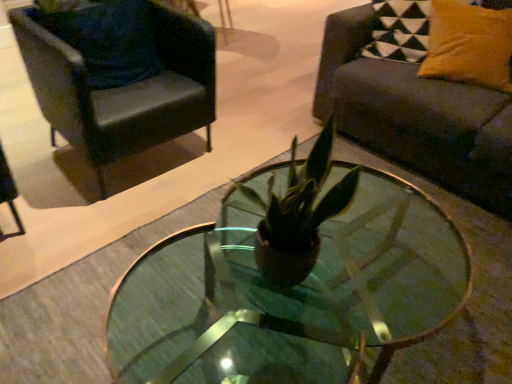
Describe the element at coordinates (469, 45) in the screenshot. The height and width of the screenshot is (384, 512). I see `velvet yellow pillow at upper right, the 1th pillow from the right` at that location.

The height and width of the screenshot is (384, 512). Describe the element at coordinates (289, 295) in the screenshot. I see `transparent glass coffee table at center` at that location.

How much space does velvet dark blue pillow at upper left, positioned as the 1th pillow in left-to-right order, occupy vertically?

The height of velvet dark blue pillow at upper left, positioned as the 1th pillow in left-to-right order, is 21.68 inches.

The width and height of the screenshot is (512, 384). Identify the location of velvet dark blue pillow at upper left, positioned as the 1th pillow in left-to-right order. (106, 38).

The width and height of the screenshot is (512, 384). Find the location of `velvet yellow pillow at upper right, the 1th pillow from the right`. velvet yellow pillow at upper right, the 1th pillow from the right is located at coordinates (469, 45).

How different are the orientations of velvet yellow pillow at upper right, which is the 2th pillow from left to right, and dark gray fabric couch at right in degrees?

15.5 degrees separate the facing orientations of velvet yellow pillow at upper right, which is the 2th pillow from left to right, and dark gray fabric couch at right.

Is dark gray fabric couch at right located within velvet yellow pillow at upper right, the 1th pillow from the right?

Definitely not — dark gray fabric couch at right is not inside velvet yellow pillow at upper right, the 1th pillow from the right.

Considering the sizes of objects velvet yellow pillow at upper right, which is the 2th pillow from left to right, and dark gray fabric couch at right in the image provided, who is bigger, velvet yellow pillow at upper right, which is the 2th pillow from left to right, or dark gray fabric couch at right?

Bigger between the two is dark gray fabric couch at right.

Is velvet yellow pillow at upper right, which is the 2th pillow from left to right, touching dark gray fabric couch at right?

No, velvet yellow pillow at upper right, which is the 2th pillow from left to right, is not beside dark gray fabric couch at right.

Would you consider black leather chair at upper left to be distant from dark gray fabric couch at right?

That's right, there is a large distance between black leather chair at upper left and dark gray fabric couch at right.

How distant is black leather chair at upper left from dark gray fabric couch at right?

black leather chair at upper left and dark gray fabric couch at right are 3.59 feet apart.

Is black leather chair at upper left oriented away from dark gray fabric couch at right?

black leather chair at upper left is not turned away from dark gray fabric couch at right.

Based on the photo, from a real-world perspective, is black leather chair at upper left positioned above or below dark gray fabric couch at right?

From a real-world perspective, black leather chair at upper left is physically below dark gray fabric couch at right.

From a real-world perspective, is velvet yellow pillow at upper right, which is the 2th pillow from left to right, on velvet dark blue pillow at upper left, marked as the 2th pillow in a right-to-left arrangement?

Yes.

Could velvet dark blue pillow at upper left, positioned as the 1th pillow in left-to-right order, be considered to be inside velvet yellow pillow at upper right, which is the 2th pillow from left to right?

No.

Considering the positions of objects velvet yellow pillow at upper right, which is the 2th pillow from left to right, and velvet dark blue pillow at upper left, marked as the 2th pillow in a right-to-left arrangement, in the image provided, who is more to the left, velvet yellow pillow at upper right, which is the 2th pillow from left to right, or velvet dark blue pillow at upper left, marked as the 2th pillow in a right-to-left arrangement,?

Positioned to the left is velvet dark blue pillow at upper left, marked as the 2th pillow in a right-to-left arrangement.

Is velvet yellow pillow at upper right, the 1th pillow from the right, positioned far away from velvet dark blue pillow at upper left, positioned as the 1th pillow in left-to-right order?

Indeed, velvet yellow pillow at upper right, the 1th pillow from the right, is not near velvet dark blue pillow at upper left, positioned as the 1th pillow in left-to-right order.

Which of these two, transparent glass coffee table at center or dark gray fabric couch at right, is wider?

dark gray fabric couch at right.

From the image's perspective, who appears lower, transparent glass coffee table at center or dark gray fabric couch at right?

transparent glass coffee table at center, from the image's perspective.

Is transparent glass coffee table at center closer to the viewer compared to dark gray fabric couch at right?

Yes, it is in front of dark gray fabric couch at right.

How much distance is there between transparent glass coffee table at center and dark gray fabric couch at right?

A distance of 28.64 inches exists between transparent glass coffee table at center and dark gray fabric couch at right.

From a real-world perspective, between velvet dark blue pillow at upper left, marked as the 2th pillow in a right-to-left arrangement, and dark gray fabric couch at right, who is vertically higher?

From a 3D spatial view, velvet dark blue pillow at upper left, marked as the 2th pillow in a right-to-left arrangement, is above.

Between velvet dark blue pillow at upper left, marked as the 2th pillow in a right-to-left arrangement, and dark gray fabric couch at right, which one is positioned behind?

velvet dark blue pillow at upper left, marked as the 2th pillow in a right-to-left arrangement, is more distant.

What's the angular difference between velvet dark blue pillow at upper left, marked as the 2th pillow in a right-to-left arrangement, and dark gray fabric couch at right's facing directions?

There is a 88.6-degree angle between the facing directions of velvet dark blue pillow at upper left, marked as the 2th pillow in a right-to-left arrangement, and dark gray fabric couch at right.

Is velvet dark blue pillow at upper left, marked as the 2th pillow in a right-to-left arrangement, taller or shorter than dark gray fabric couch at right?

velvet dark blue pillow at upper left, marked as the 2th pillow in a right-to-left arrangement, is shorter than dark gray fabric couch at right.

Considering the positions of points (69, 29) and (48, 96), is point (69, 29) farther from camera compared to point (48, 96)?

Yes, it is behind point (48, 96).

You are a GUI agent. You are given a task and a screenshot of the screen. Output one action in this format:
    pyautogui.click(x=<x>, y=<y>)
    Task: Click on the pillow on the left of black leather chair at upper left
    
    Given the screenshot: What is the action you would take?
    pyautogui.click(x=106, y=38)

Is velvet dark blue pillow at upper left, positioned as the 1th pillow in left-to-right order, in front of black leather chair at upper left?

No, it is not.

From a real-world perspective, is velvet dark blue pillow at upper left, positioned as the 1th pillow in left-to-right order, over velvet yellow pillow at upper right, the 1th pillow from the right?

Incorrect, from a real-world perspective, velvet dark blue pillow at upper left, positioned as the 1th pillow in left-to-right order, is lower than velvet yellow pillow at upper right, the 1th pillow from the right.

Is the surface of velvet dark blue pillow at upper left, marked as the 2th pillow in a right-to-left arrangement, in direct contact with velvet yellow pillow at upper right, the 1th pillow from the right?

velvet dark blue pillow at upper left, marked as the 2th pillow in a right-to-left arrangement, is not next to velvet yellow pillow at upper right, the 1th pillow from the right, and they're not touching.

From the image's perspective, which is above, velvet dark blue pillow at upper left, positioned as the 1th pillow in left-to-right order, or velvet yellow pillow at upper right, the 1th pillow from the right?

velvet yellow pillow at upper right, the 1th pillow from the right, from the image's perspective.

The image size is (512, 384). What are the coordinates of `pillow above the velvet dark blue pillow at upper left, marked as the 2th pillow in a right-to-left arrangement (from the image's perspective)` in the screenshot? It's located at (469, 45).

Locate an element on the screen. Image resolution: width=512 pixels, height=384 pixels. pillow that is the 2nd one when counting upward from the dark gray fabric couch at right (from the image's perspective) is located at coordinates (469, 45).

The width and height of the screenshot is (512, 384). In order to click on studio couch in front of the black leather chair at upper left in this screenshot , I will do `click(416, 115)`.

Estimate the real-world distances between objects in this image. Which object is further from black leather chair at upper left, transparent glass coffee table at center or dark gray fabric couch at right?

Based on the image, dark gray fabric couch at right appears to be further to black leather chair at upper left.

Which object lies further to the anchor point velvet dark blue pillow at upper left, marked as the 2th pillow in a right-to-left arrangement, velvet yellow pillow at upper right, which is the 2th pillow from left to right, or dark gray fabric couch at right?

velvet yellow pillow at upper right, which is the 2th pillow from left to right, is positioned further to the anchor velvet dark blue pillow at upper left, marked as the 2th pillow in a right-to-left arrangement.

Which object lies nearer to the anchor point dark gray fabric couch at right, black leather chair at upper left or velvet yellow pillow at upper right, which is the 2th pillow from left to right?

Based on the image, velvet yellow pillow at upper right, which is the 2th pillow from left to right, appears to be nearer to dark gray fabric couch at right.

Considering their positions, is velvet dark blue pillow at upper left, marked as the 2th pillow in a right-to-left arrangement, positioned closer to black leather chair at upper left than transparent glass coffee table at center?

The object closer to black leather chair at upper left is velvet dark blue pillow at upper left, marked as the 2th pillow in a right-to-left arrangement.

Which object lies nearer to the anchor point dark gray fabric couch at right, transparent glass coffee table at center or velvet yellow pillow at upper right, the 1th pillow from the right?

velvet yellow pillow at upper right, the 1th pillow from the right, is closer to dark gray fabric couch at right.

Consider the image. Which object lies further to the anchor point black leather chair at upper left, velvet yellow pillow at upper right, the 1th pillow from the right, or transparent glass coffee table at center?

Among the two, velvet yellow pillow at upper right, the 1th pillow from the right, is located further to black leather chair at upper left.

From the image, which object appears to be farther from velvet dark blue pillow at upper left, marked as the 2th pillow in a right-to-left arrangement, black leather chair at upper left or dark gray fabric couch at right?

The object further to velvet dark blue pillow at upper left, marked as the 2th pillow in a right-to-left arrangement, is dark gray fabric couch at right.

When comparing their distances from black leather chair at upper left, does transparent glass coffee table at center or velvet yellow pillow at upper right, the 1th pillow from the right, seem further?

velvet yellow pillow at upper right, the 1th pillow from the right, lies further to black leather chair at upper left than the other object.

Find the location of `coffee table situated between velvet dark blue pillow at upper left, marked as the 2th pillow in a right-to-left arrangement, and dark gray fabric couch at right from left to right`. coffee table situated between velvet dark blue pillow at upper left, marked as the 2th pillow in a right-to-left arrangement, and dark gray fabric couch at right from left to right is located at coordinates (289, 295).

The image size is (512, 384). I want to click on coffee table located between velvet dark blue pillow at upper left, marked as the 2th pillow in a right-to-left arrangement, and velvet yellow pillow at upper right, the 1th pillow from the right, in the left-right direction, so click(289, 295).

Locate an element on the screen. This screenshot has width=512, height=384. pillow located between velvet dark blue pillow at upper left, marked as the 2th pillow in a right-to-left arrangement, and dark gray fabric couch at right in the left-right direction is located at coordinates (469, 45).

The image size is (512, 384). I want to click on chair between velvet dark blue pillow at upper left, positioned as the 1th pillow in left-to-right order, and dark gray fabric couch at right from left to right, so click(x=123, y=90).